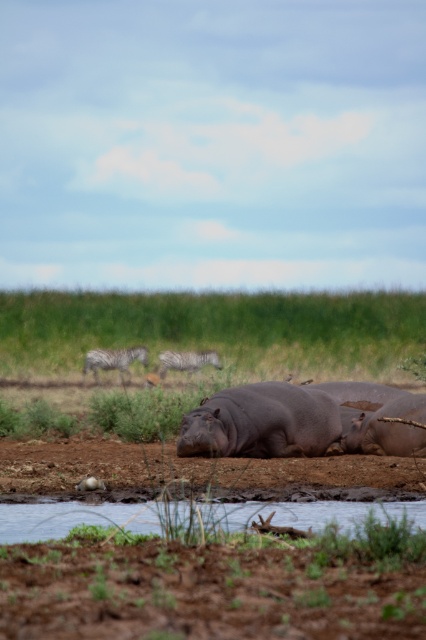
You are a photographer trying to capture a photo of the matte gray hippo at center and the gray striped zebra at center. From your current position, which animal is positioned to the right of the other?

The matte gray hippo at center is positioned on the right side of gray striped zebra at center, so the matte gray hippo at center is to the right of the gray striped zebra at center.